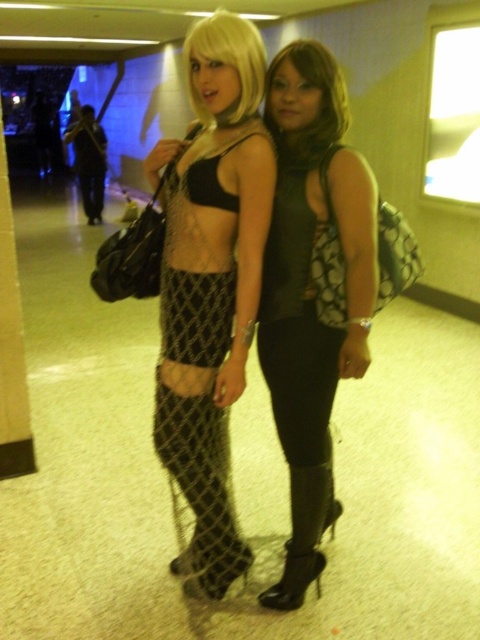
Does point (288, 230) come behind point (328, 74)?

Yes, point (288, 230) is farther from viewer.

Describe the element at coordinates (311, 292) in the screenshot. I see `matte black top at center` at that location.

Does point (291, 548) lie in front of point (316, 49)?

No.

Identify the location of matte black top at center. The width and height of the screenshot is (480, 640). 311,292.

How far apart are matte black mesh skirt at center and matte black top at center?

matte black mesh skirt at center is 7.98 inches away from matte black top at center.

Can you confirm if matte black mesh skirt at center is positioned below matte black top at center?

Incorrect, matte black mesh skirt at center is not positioned below matte black top at center.

Locate an element on the screen. This screenshot has height=640, width=480. matte black mesh skirt at center is located at coordinates (211, 282).

Locate an element on the screen. The image size is (480, 640). matte black mesh skirt at center is located at coordinates (211, 282).

Is matte black top at center wider than netted fabric legging at center?

Yes.

Who is positioned more to the right, matte black top at center or netted fabric legging at center?

matte black top at center is more to the right.

Between point (348, 371) and point (240, 552), which one is positioned in front?

Point (348, 371) is more forward.

The height and width of the screenshot is (640, 480). In order to click on matte black top at center in this screenshot , I will do `click(311, 292)`.